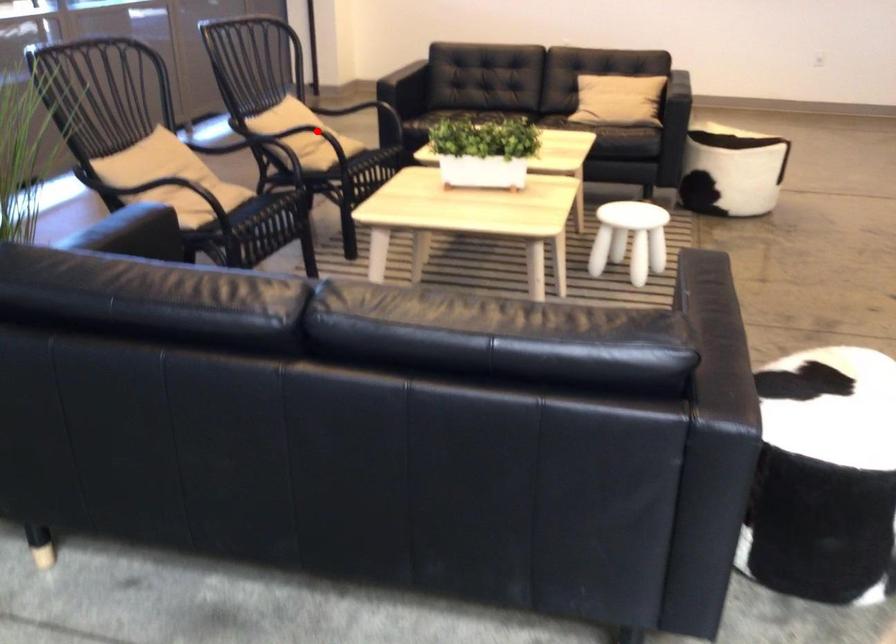
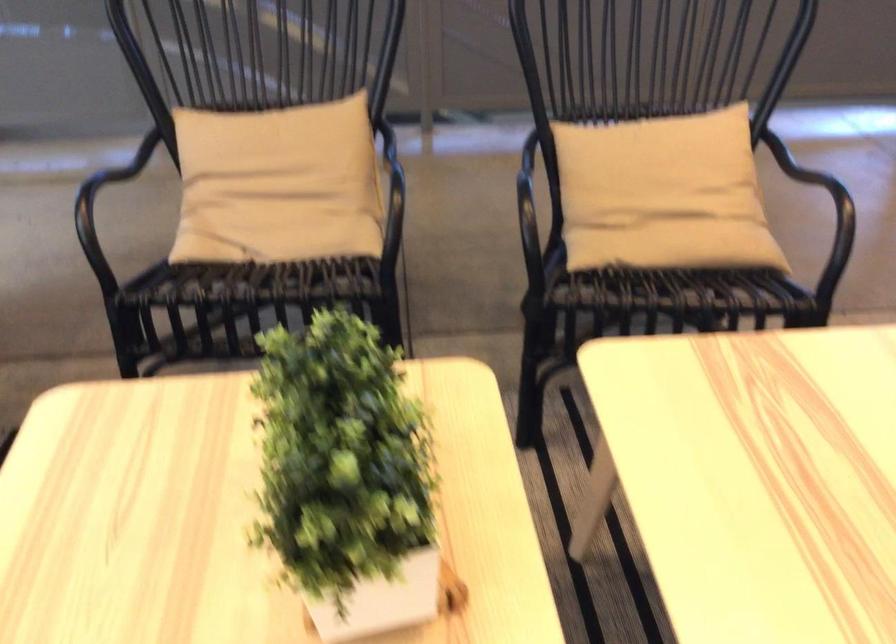
Question: I am providing you with two images of the same scene from different viewpoints. Given a red point in image1, look at the same physical point in image2. Is it:

Choices:
 (A) Closer to the viewpoint
 (B) Farther from the viewpoint

Answer: (A)